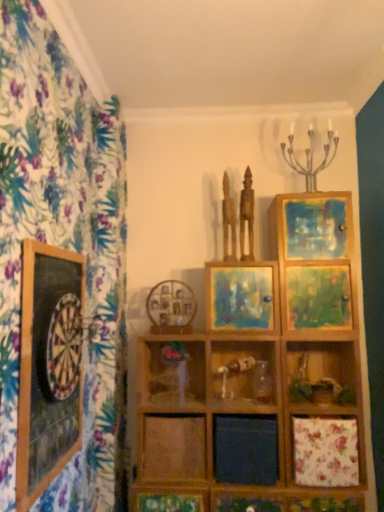
You are a GUI agent. You are given a task and a screenshot of the screen. Output one action in this format:
    pyautogui.click(x=<x>, y=<y>)
    Task: Click on the vacant space underneath wooden picture frame at center, positioned as the second picture frame in right-to-left order (from a real-world perspective)
    The image size is (384, 512).
    Given the screenshot: What is the action you would take?
    pyautogui.click(x=170, y=335)